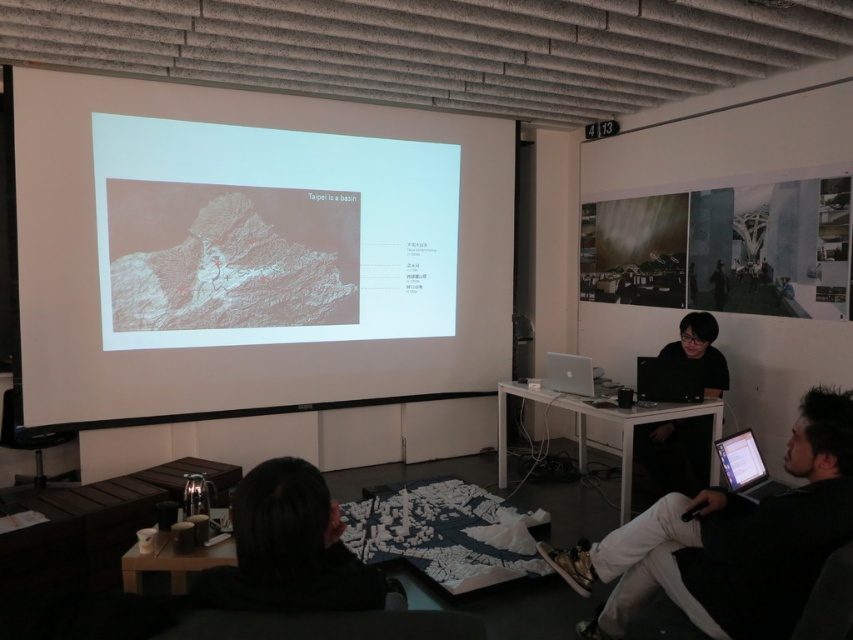
Is black matte shirt at center wider than silver metallic laptop at center?

Yes, black matte shirt at center is wider than silver metallic laptop at center.

Locate an element on the screen. black matte shirt at center is located at coordinates (675, 452).

Is white matte projection screen at upper left to the right of silver metallic laptop at lower right from the viewer's perspective?

In fact, white matte projection screen at upper left is to the left of silver metallic laptop at lower right.

Which of these two, white matte projection screen at upper left or silver metallic laptop at lower right, stands shorter?

silver metallic laptop at lower right

Describe the element at coordinates (270, 184) in the screenshot. The height and width of the screenshot is (640, 853). I see `white matte projection screen at upper left` at that location.

Find the location of a particular element. This screenshot has height=640, width=853. white matte projection screen at upper left is located at coordinates (270, 184).

Can you confirm if black fabric chair at lower right is bigger than black matte shirt at center?

Indeed, black fabric chair at lower right has a larger size compared to black matte shirt at center.

Who is shorter, black fabric chair at lower right or black matte shirt at center?

Standing shorter between the two is black fabric chair at lower right.

Image resolution: width=853 pixels, height=640 pixels. What do you see at coordinates (730, 541) in the screenshot? I see `black fabric chair at lower right` at bounding box center [730, 541].

Locate an element on the screen. This screenshot has width=853, height=640. black fabric chair at lower right is located at coordinates tap(730, 541).